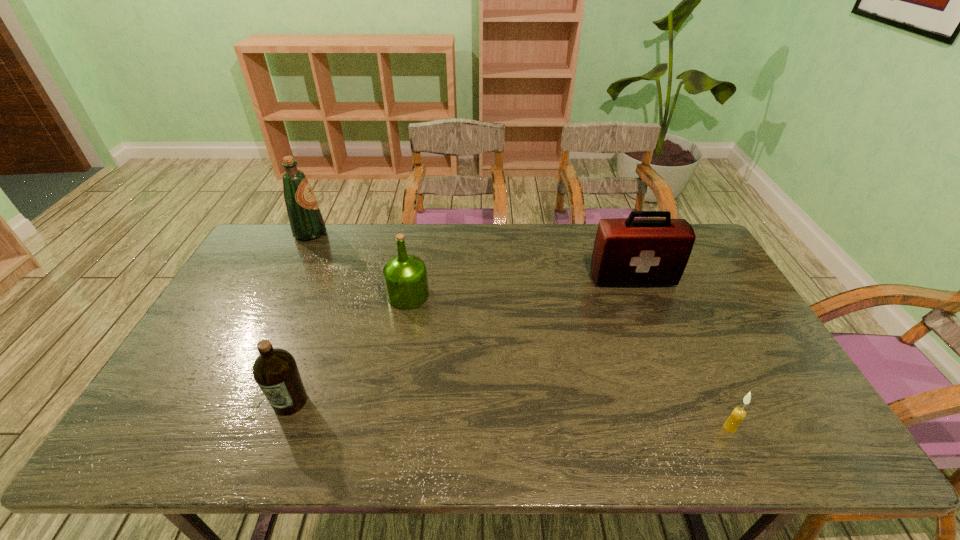
The width and height of the screenshot is (960, 540). I want to click on free spot at the near edge of the desktop, so coord(491,435).

Where is `free space at the left edge of the desktop`? free space at the left edge of the desktop is located at coordinates (238, 293).

The height and width of the screenshot is (540, 960). I want to click on free space at the right edge of the desktop, so click(x=739, y=399).

Image resolution: width=960 pixels, height=540 pixels. In order to click on vacant region at the far left corner of the desktop in this screenshot , I will do `click(277, 239)`.

In the image, there is a desktop. Where is `vacant space at the near right corner`? vacant space at the near right corner is located at coordinates (817, 447).

The width and height of the screenshot is (960, 540). I want to click on free space between the nearest olive oil and the candle, so click(510, 415).

In order to click on unoccupied position between the fourth farthest object and the rightmost olive oil in this screenshot , I will do `click(349, 348)`.

Image resolution: width=960 pixels, height=540 pixels. In order to click on empty space between the first aid kit and the second farthest olive oil in this screenshot , I will do `click(520, 287)`.

Where is `vacant area that lies between the leftmost object and the nearest object`? Image resolution: width=960 pixels, height=540 pixels. vacant area that lies between the leftmost object and the nearest object is located at coordinates (520, 330).

Locate an element on the screen. Image resolution: width=960 pixels, height=540 pixels. free space between the second farthest olive oil and the shortest object is located at coordinates (569, 361).